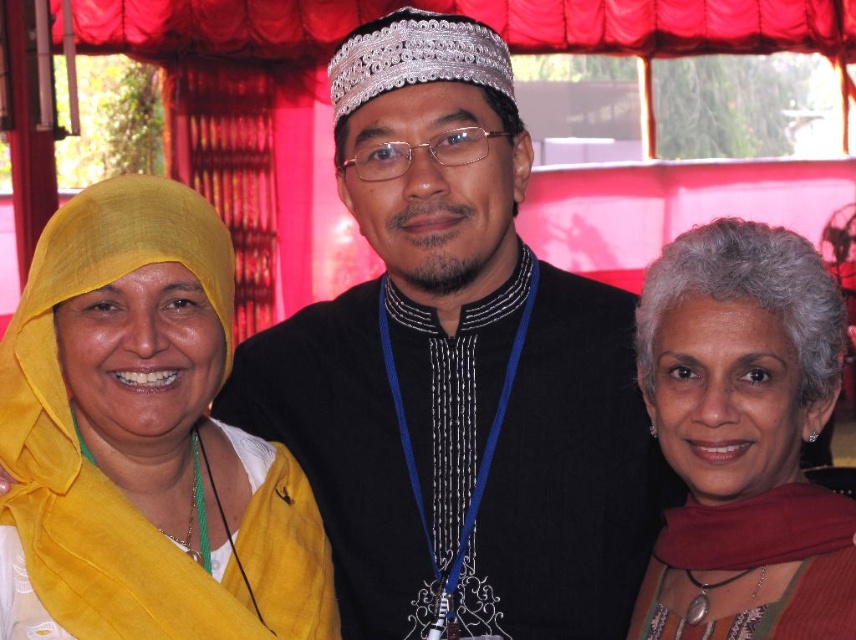
Question: Among these points, which one is nearest to the camera?

Choices:
 (A) (330, 595)
 (B) (749, 470)

Answer: (B)

Question: Is black fabric at center above matte red scarf at right?

Choices:
 (A) yes
 (B) no

Answer: (A)

Question: Is black fabric at center thinner than matte yellow scarf at left?

Choices:
 (A) yes
 (B) no

Answer: (B)

Question: Which point is closer to the camera?

Choices:
 (A) (604, 518)
 (B) (113, 426)
 (C) (801, 627)

Answer: (C)

Question: Is black fabric at center to the right of matte yellow scarf at left from the viewer's perspective?

Choices:
 (A) yes
 (B) no

Answer: (A)

Question: Which of the following is the farthest from the observer?

Choices:
 (A) matte red scarf at right
 (B) matte yellow scarf at left
 (C) black fabric at center

Answer: (C)